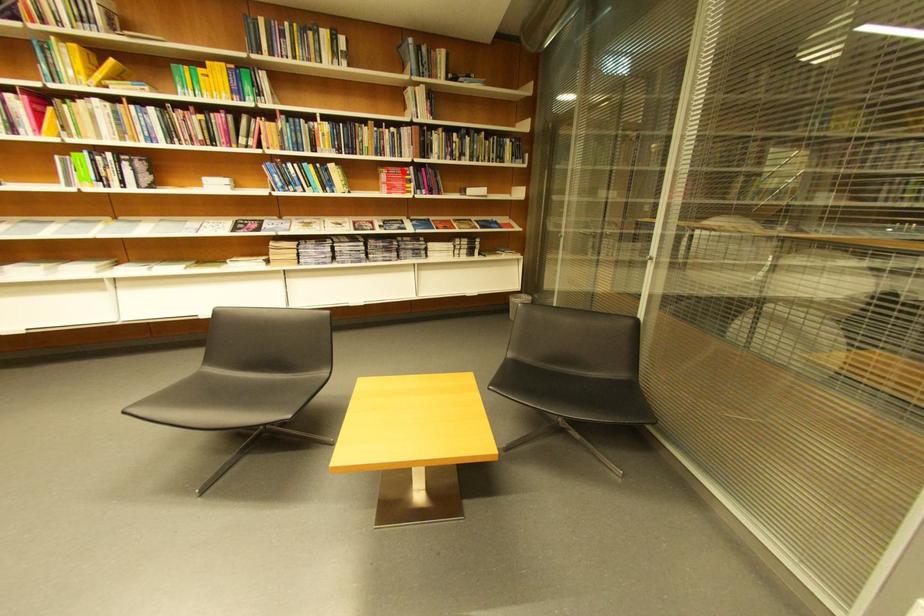
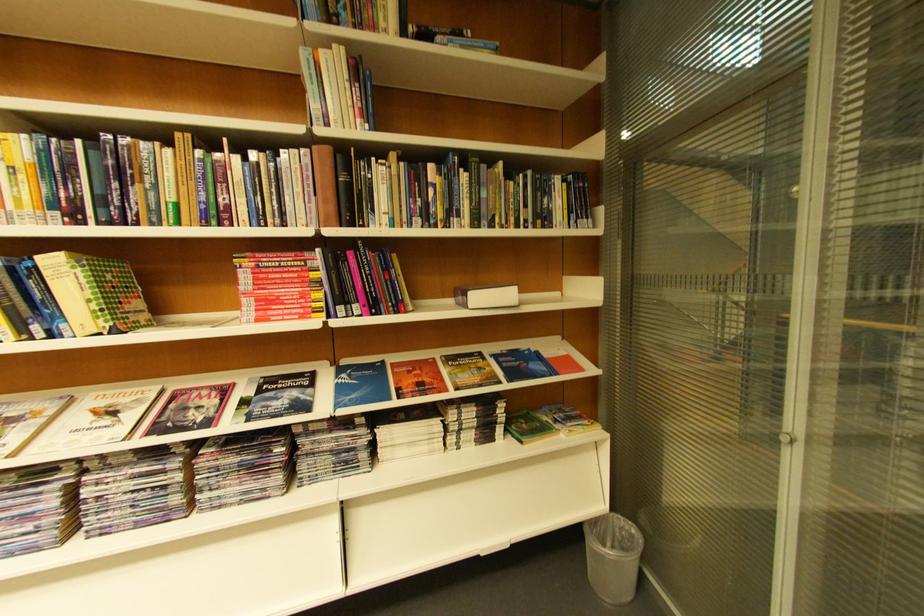
Where in the second image is the point corresponding to the highlighted location from the first image?

(281, 262)